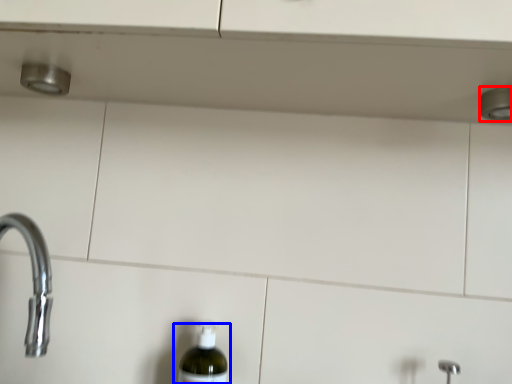
Question: Which object appears closest to the camera in this image, shower (highlighted by a red box) or bottle (highlighted by a blue box)?

Choices:
 (A) shower
 (B) bottle

Answer: (A)